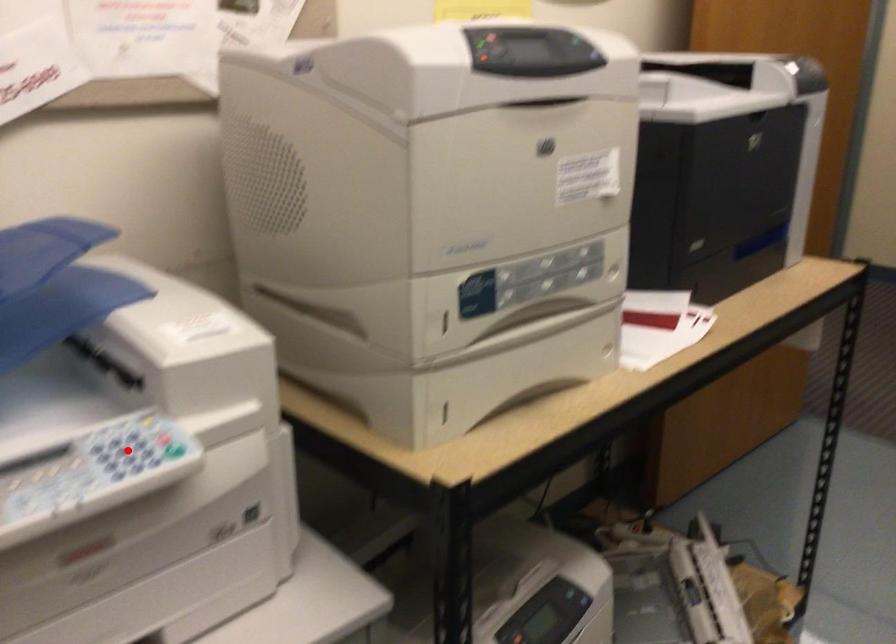
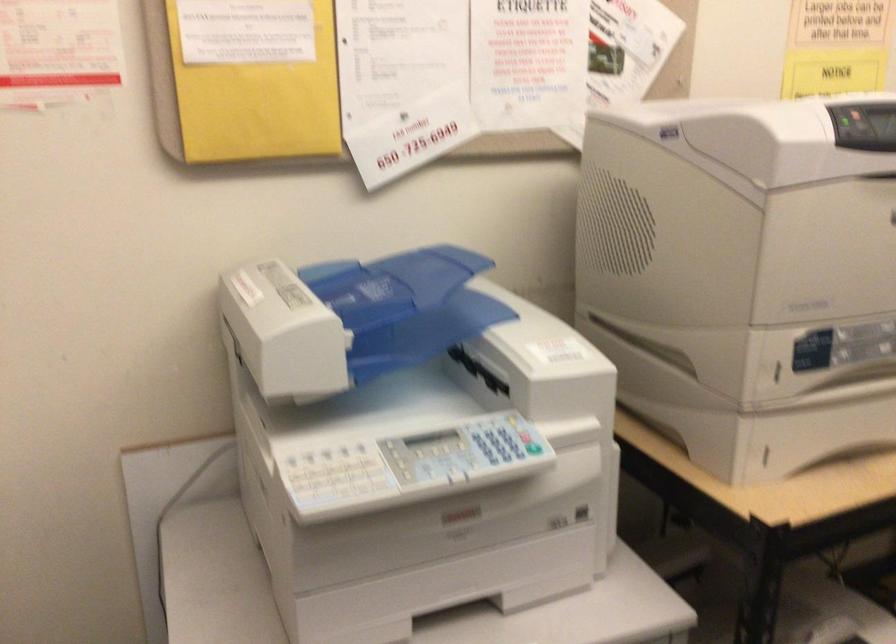
Find the pixel in the second image that matches the highlighted location in the first image.

(495, 444)